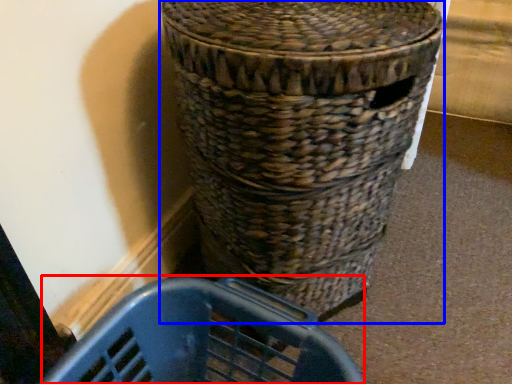
Question: Which of the following is the closest to the observer, basket container (highlighted by a red box) or waste container (highlighted by a blue box)?

Choices:
 (A) basket container
 (B) waste container

Answer: (B)